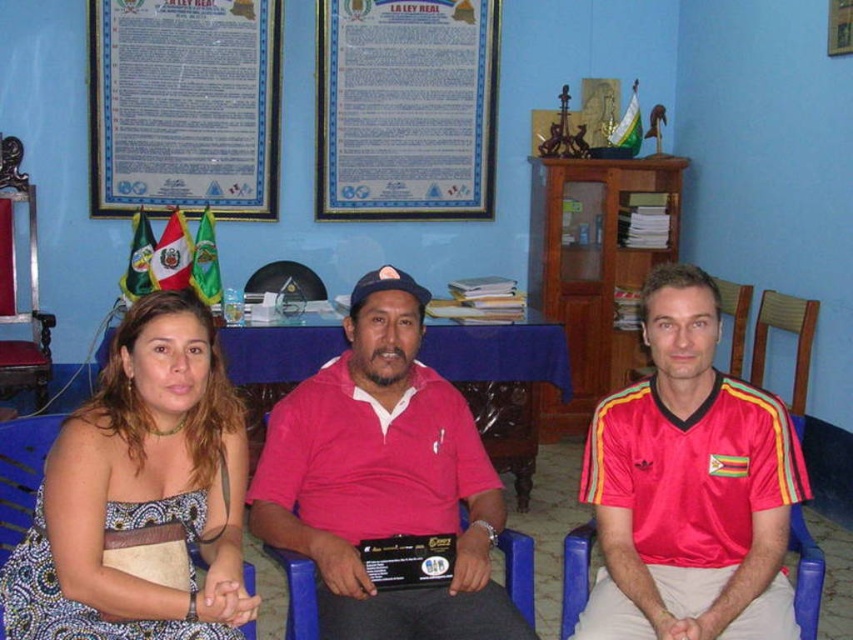
Based on the photo, who is more distant from viewer, (x=202, y=410) or (x=508, y=637)?

Point (x=202, y=410)

Image resolution: width=853 pixels, height=640 pixels. Identify the location of printed fabric dress at center. (140, 496).

Is red shiny jersey at center to the left of blue plastic chair at center from the viewer's perspective?

No, red shiny jersey at center is not to the left of blue plastic chair at center.

Is point (691, 372) farther from camera compared to point (498, 625)?

Yes, it is.

What do you see at coordinates (689, 486) in the screenshot? This screenshot has width=853, height=640. I see `red shiny jersey at center` at bounding box center [689, 486].

In order to click on red shiny jersey at center in this screenshot , I will do `click(689, 486)`.

Does printed fabric dress at center appear over wooden polished chair at left?

Incorrect, printed fabric dress at center is not positioned above wooden polished chair at left.

Is printed fabric dress at center positioned before wooden polished chair at left?

Yes, it is.

Locate an element on the screen. The image size is (853, 640). printed fabric dress at center is located at coordinates (140, 496).